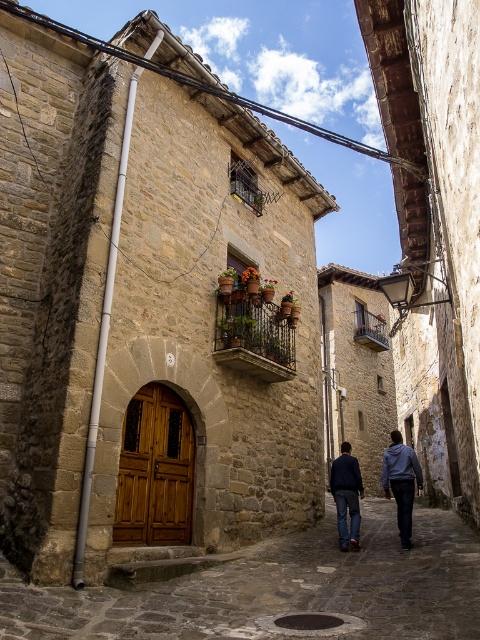
Does dark blue jeans at center appear over dark blue denim jeans at center?

Incorrect, dark blue jeans at center is not positioned above dark blue denim jeans at center.

Does dark blue jeans at center appear on the left side of dark blue denim jeans at center?

In fact, dark blue jeans at center is to the right of dark blue denim jeans at center.

What are the coordinates of `dark blue jeans at center` in the screenshot? It's located at (400, 481).

This screenshot has height=640, width=480. I want to click on dark blue jeans at center, so click(x=400, y=481).

Is dark gray hoodie at center shorter than dark blue denim jeans at center?

In fact, dark gray hoodie at center may be taller than dark blue denim jeans at center.

Does point (415, 454) come closer to viewer compared to point (338, 504)?

Yes, it is.

Where is `dark gray hoodie at center`? dark gray hoodie at center is located at coordinates (400, 481).

Which is below, stone cobblestone alley at center or dark blue jeans at center?

dark blue jeans at center is below.

Between point (381, 630) and point (339, 540), which one is positioned behind?

The point (339, 540) is more distant.

Image resolution: width=480 pixels, height=640 pixels. Identify the location of stone cobblestone alley at center. (280, 588).